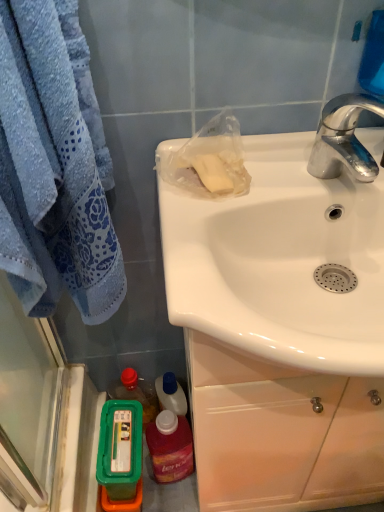
What do you see at coordinates (343, 139) in the screenshot? The height and width of the screenshot is (512, 384). I see `chrome metallic faucet at upper right` at bounding box center [343, 139].

The width and height of the screenshot is (384, 512). What do you see at coordinates (280, 432) in the screenshot?
I see `white glossy cabinet at center` at bounding box center [280, 432].

Where is `white glossy sink at upper right`? The width and height of the screenshot is (384, 512). white glossy sink at upper right is located at coordinates (284, 246).

Locate an element on the screen. green plastic container at lower left, the first mouthwash in the left-to-right sequence is located at coordinates (120, 455).

Image resolution: width=384 pixels, height=512 pixels. Find the location of `soft blue towel at left`. soft blue towel at left is located at coordinates (54, 165).

From the picture: From a real-world perspective, which is physically above, green plastic container at lower left, the first mouthwash in the left-to-right sequence, or soft blue towel at left?

soft blue towel at left.

Is green plastic container at lower left, the 2th mouthwash viewed from the right, smaller than soft blue towel at left?

Yes.

Is green plastic container at lower left, the 2th mouthwash viewed from the right, oriented away from soft blue towel at left?

No, green plastic container at lower left, the 2th mouthwash viewed from the right,'s orientation is not away from soft blue towel at left.

Is green plastic container at lower left further to the viewer compared to white glossy cabinet at center?

Yes, green plastic container at lower left is further from the camera.

Between green plastic container at lower left and white glossy cabinet at center, which one has more height?

white glossy cabinet at center.

Could white glossy cabinet at center be considered to be inside green plastic container at lower left?

No, green plastic container at lower left does not contain white glossy cabinet at center.

From the picture: Considering the positions of objects green plastic container at lower left and white glossy cabinet at center in the image provided, who is more to the right, green plastic container at lower left or white glossy cabinet at center?

white glossy cabinet at center.

In the scene shown: Is green plastic container at lower left not inside soft blue towel at left?

Yes, green plastic container at lower left is located beyond the bounds of soft blue towel at left.

Is green plastic container at lower left positioned in front of soft blue towel at left?

No, it is not.

Considering the sizes of objects green plastic container at lower left and soft blue towel at left in the image provided, who is bigger, green plastic container at lower left or soft blue towel at left?

soft blue towel at left.

Which is behind, white glossy sink at upper right or translucent plastic mouthwash at lower left, the first mouthwash from the right?

Positioned behind is translucent plastic mouthwash at lower left, the first mouthwash from the right.

Could you tell me if white glossy sink at upper right is turned towards translucent plastic mouthwash at lower left, the second mouthwash when ordered from left to right?

No, white glossy sink at upper right is not turned towards translucent plastic mouthwash at lower left, the second mouthwash when ordered from left to right.

Is white glossy sink at upper right taller than translucent plastic mouthwash at lower left, the second mouthwash when ordered from left to right?

In fact, white glossy sink at upper right may be shorter than translucent plastic mouthwash at lower left, the second mouthwash when ordered from left to right.

Can you confirm if white glossy sink at upper right is thinner than translucent plastic mouthwash at lower left, the first mouthwash from the right?

No, white glossy sink at upper right is not thinner than translucent plastic mouthwash at lower left, the first mouthwash from the right.

From a real-world perspective, relative to translucent plastic mouthwash at lower left, the first mouthwash from the right, is white glossy cabinet at center vertically above or below?

In terms of real-world spatial position, white glossy cabinet at center is above translucent plastic mouthwash at lower left, the first mouthwash from the right.

Looking at the image, does white glossy cabinet at center seem bigger or smaller compared to translucent plastic mouthwash at lower left, the second mouthwash when ordered from left to right?

Considering their sizes, white glossy cabinet at center takes up more space than translucent plastic mouthwash at lower left, the second mouthwash when ordered from left to right.

Would you say white glossy cabinet at center is inside or outside translucent plastic mouthwash at lower left, the second mouthwash when ordered from left to right?

white glossy cabinet at center cannot be found inside translucent plastic mouthwash at lower left, the second mouthwash when ordered from left to right.

From the image's perspective, relative to translucent plastic mouthwash at lower left, the second mouthwash when ordered from left to right, is white glossy cabinet at center above or below?

white glossy cabinet at center is above translucent plastic mouthwash at lower left, the second mouthwash when ordered from left to right.

Is the depth of white glossy sink at upper right greater than that of chrome metallic faucet at upper right?

No.

This screenshot has height=512, width=384. I want to click on sink that appears below the chrome metallic faucet at upper right (from the image's perspective), so click(x=284, y=246).

Which point is more forward, (x=370, y=331) or (x=334, y=151)?

Positioned in front is point (x=370, y=331).

Which is more to the right, white glossy sink at upper right or chrome metallic faucet at upper right?

chrome metallic faucet at upper right is more to the right.

Is white glossy sink at upper right completely or partially inside green plastic container at lower left?

No, white glossy sink at upper right is not a part of green plastic container at lower left.

Could you tell me if green plastic container at lower left is facing white glossy sink at upper right?

No, green plastic container at lower left is not facing towards white glossy sink at upper right.

Who is shorter, green plastic container at lower left or white glossy sink at upper right?

With less height is white glossy sink at upper right.

From a real-world perspective, which is physically below, green plastic container at lower left or white glossy sink at upper right?

In real-world perspective, green plastic container at lower left is lower.

Starting from the soft blue towel at left, which mouthwash is the 1st one behind? Please provide its 2D coordinates.

[(120, 455)]

Where is `bottle below the white glossy cabinet at center (from a real-world perspective)`? The height and width of the screenshot is (512, 384). bottle below the white glossy cabinet at center (from a real-world perspective) is located at coordinates (136, 393).

Which object lies further to the anchor point soft blue towel at left, chrome metallic faucet at upper right or green plastic container at lower left?

green plastic container at lower left lies further to soft blue towel at left than the other object.

From the image, which object appears to be nearer to green plastic container at lower left, the 2th mouthwash viewed from the right, green plastic container at lower left or translucent plastic mouthwash at lower left, the first mouthwash from the right?

translucent plastic mouthwash at lower left, the first mouthwash from the right.

Considering their positions, is translucent plastic mouthwash at lower left, the second mouthwash when ordered from left to right, positioned further to green plastic container at lower left than white glossy sink at upper right?

white glossy sink at upper right.

Consider the image. Considering their positions, is white glossy cabinet at center positioned further to green plastic container at lower left than green plastic container at lower left, the first mouthwash in the left-to-right sequence?

Based on the image, white glossy cabinet at center appears to be further to green plastic container at lower left.

Looking at the image, which one is located closer to chrome metallic faucet at upper right, green plastic container at lower left or soft blue towel at left?

soft blue towel at left.

Which object lies further to the anchor point white glossy cabinet at center, translucent plastic mouthwash at lower left, the first mouthwash from the right, or chrome metallic faucet at upper right?

chrome metallic faucet at upper right is positioned further to the anchor white glossy cabinet at center.

In the scene shown: From the image, which object appears to be farther from translucent plastic mouthwash at lower left, the second mouthwash when ordered from left to right, white glossy sink at upper right or white glossy cabinet at center?

The object further to translucent plastic mouthwash at lower left, the second mouthwash when ordered from left to right, is white glossy sink at upper right.

Which object lies further to the anchor point chrome metallic faucet at upper right, white glossy cabinet at center or white glossy sink at upper right?

white glossy cabinet at center.

Locate an element on the screen. This screenshot has width=384, height=512. mouthwash between white glossy sink at upper right and translucent plastic mouthwash at lower left, the second mouthwash when ordered from left to right, from front to back is located at coordinates (120, 455).

Where is `mouthwash between soft blue towel at left and green plastic container at lower left, the first mouthwash in the left-to-right sequence, in the up-down direction`? The width and height of the screenshot is (384, 512). mouthwash between soft blue towel at left and green plastic container at lower left, the first mouthwash in the left-to-right sequence, in the up-down direction is located at coordinates (170, 447).

Locate an element on the screen. The image size is (384, 512). sink between chrome metallic faucet at upper right and white glossy cabinet at center in the vertical direction is located at coordinates (284, 246).

Where is `sink between soft blue towel at left and chrome metallic faucet at upper right from left to right`? This screenshot has height=512, width=384. sink between soft blue towel at left and chrome metallic faucet at upper right from left to right is located at coordinates (284, 246).